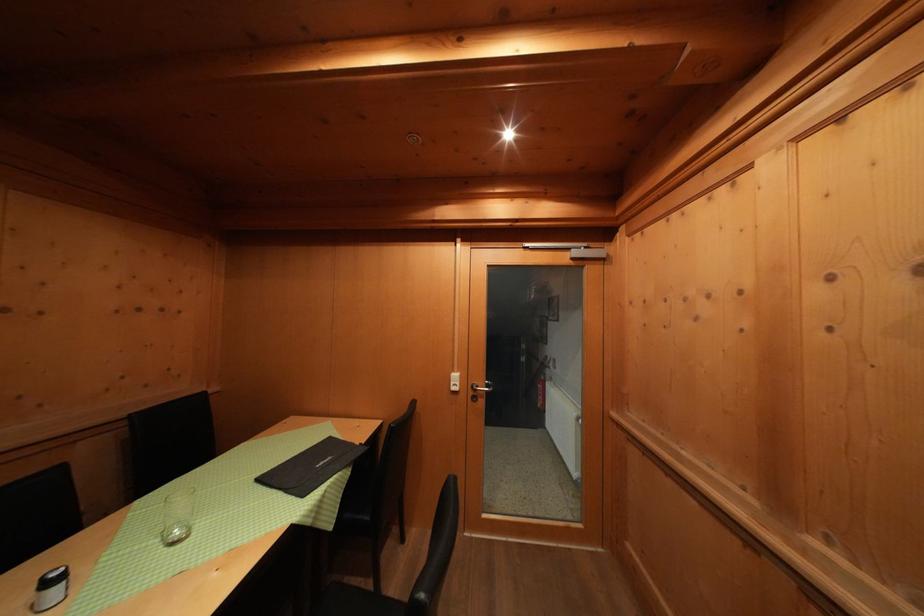
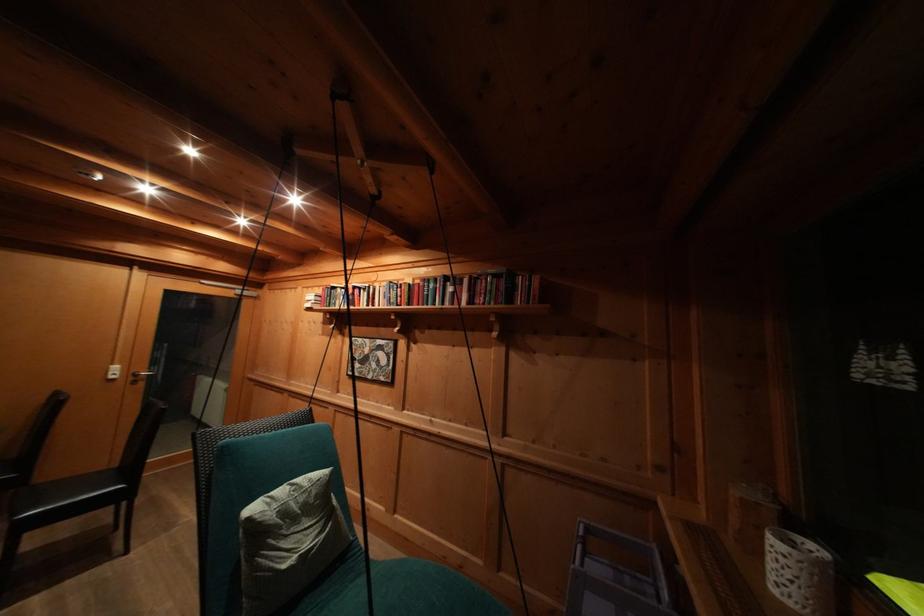
Find the pixel in the second image that matches the point at 845,123 in the first image.

(313, 293)